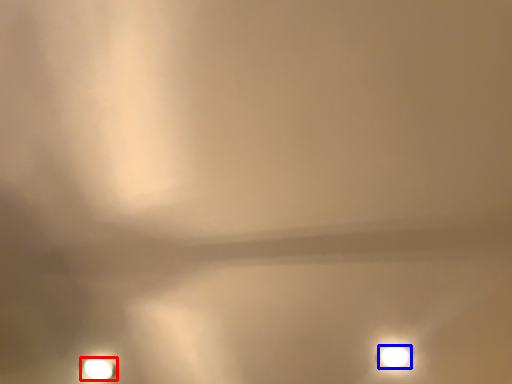
Question: Which of the following is the farthest to the observer, lamp (highlighted by a red box) or lamp (highlighted by a blue box)?

Choices:
 (A) lamp
 (B) lamp

Answer: (A)